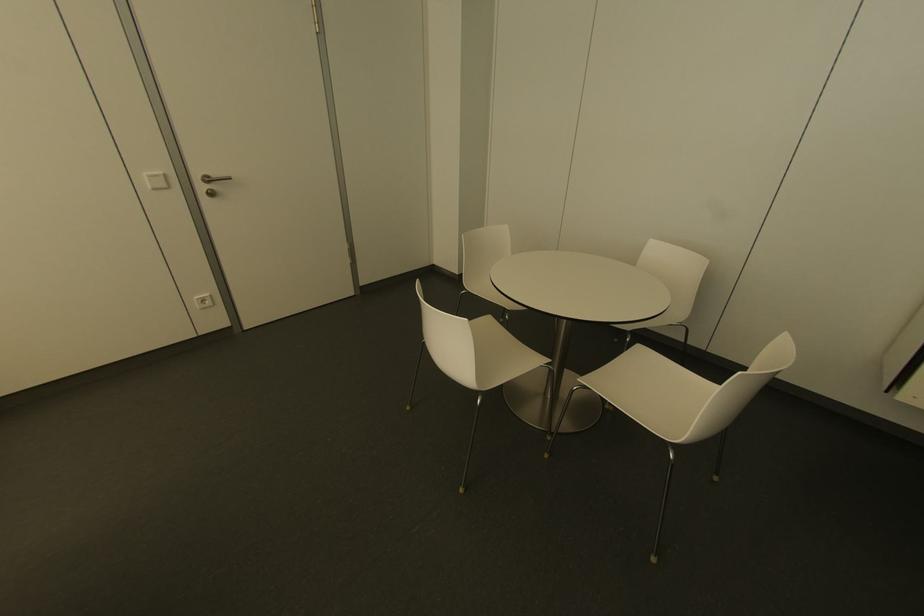
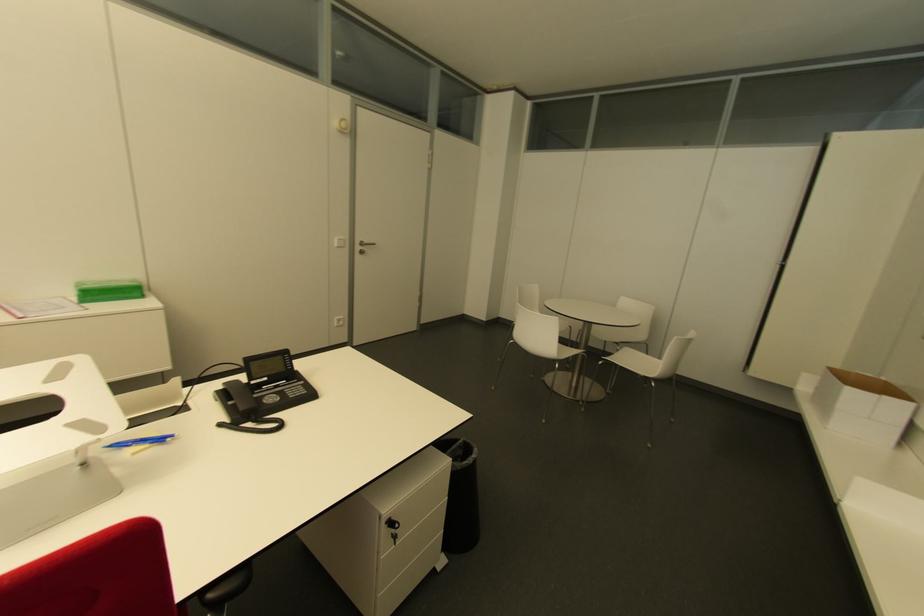
Locate, in the second image, the point that corresponds to (x=210, y=193) in the first image.

(360, 253)